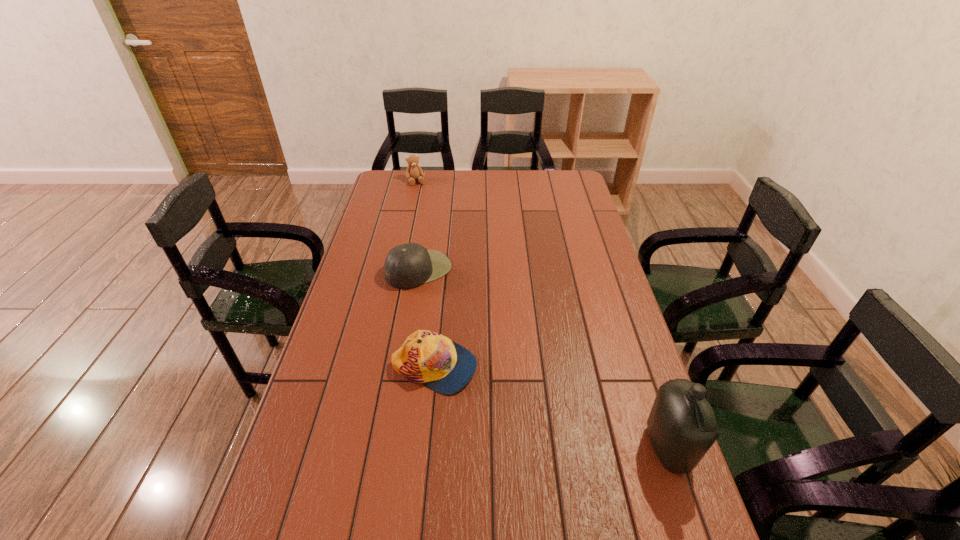
Find the location of a particular element. The width and height of the screenshot is (960, 540). free region at the right edge of the desktop is located at coordinates (602, 254).

The width and height of the screenshot is (960, 540). I want to click on vacant space at the far left corner of the desktop, so click(394, 187).

The height and width of the screenshot is (540, 960). Find the location of `vacant space in between the rightmost object and the farthest object`. vacant space in between the rightmost object and the farthest object is located at coordinates (542, 315).

Locate an element on the screen. This screenshot has width=960, height=540. free space that is in between the third farthest object and the second farthest object is located at coordinates (426, 319).

Find the location of `free space between the farthest object and the tallest object`. free space between the farthest object and the tallest object is located at coordinates click(542, 315).

The image size is (960, 540). In order to click on free space between the nearer cap and the third nearest object in this screenshot , I will do `click(426, 319)`.

Locate an element on the screen. The image size is (960, 540). empty space between the farther cap and the teddy bear is located at coordinates click(x=418, y=225).

Image resolution: width=960 pixels, height=540 pixels. I want to click on free space between the nearest object and the farther cap, so click(x=543, y=359).

Where is `unoccupied area between the teddy bear and the rightmost object`? This screenshot has height=540, width=960. unoccupied area between the teddy bear and the rightmost object is located at coordinates (542, 315).

Find the location of a particular element. This screenshot has width=960, height=540. blank region between the rightmost object and the farther cap is located at coordinates (543, 359).